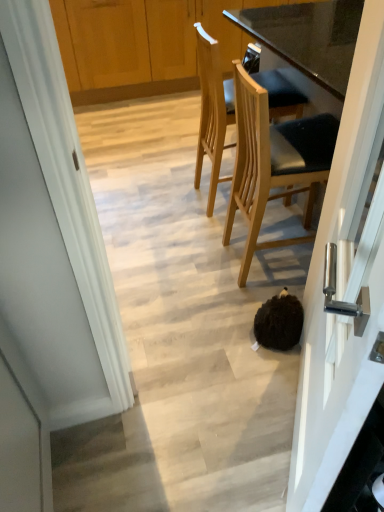
Question: Would you say light wood/texture chair at upper center, which is the 2th chair from front to back, is part of white glossy door handle at center right's contents?

Choices:
 (A) yes
 (B) no

Answer: (B)

Question: Is white glossy door handle at center right bigger than light wood/texture chair at upper center, arranged as the first chair when viewed from the back?

Choices:
 (A) no
 (B) yes

Answer: (A)

Question: From the image's perspective, does white glossy door handle at center right appear lower than light wood/texture chair at upper center, arranged as the first chair when viewed from the back?

Choices:
 (A) yes
 (B) no

Answer: (A)

Question: Can you confirm if white glossy door handle at center right is wider than light wood/texture chair at upper center, arranged as the first chair when viewed from the back?

Choices:
 (A) no
 (B) yes

Answer: (A)

Question: Does white glossy door handle at center right lie in front of light wood/texture chair at upper center, arranged as the first chair when viewed from the back?

Choices:
 (A) no
 (B) yes

Answer: (B)

Question: In terms of height, does light wood/texture chair at upper center, which is the 2th chair from front to back, look taller or shorter compared to white glossy door handle at center right?

Choices:
 (A) tall
 (B) short

Answer: (B)

Question: From a real-world perspective, is light wood/texture chair at upper center, arranged as the first chair when viewed from the back, positioned above or below white glossy door handle at center right?

Choices:
 (A) below
 (B) above

Answer: (A)

Question: Based on their sizes in the image, would you say light wood/texture chair at upper center, arranged as the first chair when viewed from the back, is bigger or smaller than white glossy door handle at center right?

Choices:
 (A) small
 (B) big

Answer: (B)

Question: Considering the relative positions of light wood/texture chair at upper center, which is the 2th chair from front to back, and white glossy door handle at center right in the image provided, is light wood/texture chair at upper center, which is the 2th chair from front to back, to the left or to the right of white glossy door handle at center right?

Choices:
 (A) right
 (B) left

Answer: (B)

Question: From the image's perspective, is light wood/texture chair at upper center, arranged as the first chair when viewed from the back, located above or below light brown wood chair at center, which ranks as the 2th chair in back-to-front order?

Choices:
 (A) above
 (B) below

Answer: (A)

Question: From a real-world perspective, relative to light brown wood chair at center, marked as the first chair in a front-to-back arrangement, is light wood/texture chair at upper center, arranged as the first chair when viewed from the back, vertically above or below?

Choices:
 (A) above
 (B) below

Answer: (B)

Question: Is point (213, 188) positioned closer to the camera than point (253, 205)?

Choices:
 (A) closer
 (B) farther

Answer: (B)

Question: Considering the relative positions of light wood/texture chair at upper center, arranged as the first chair when viewed from the back, and light brown wood chair at center, marked as the first chair in a front-to-back arrangement, in the image provided, is light wood/texture chair at upper center, arranged as the first chair when viewed from the back, to the left or to the right of light brown wood chair at center, marked as the first chair in a front-to-back arrangement,?

Choices:
 (A) right
 (B) left

Answer: (B)

Question: Is light brown wood chair at center, marked as the first chair in a front-to-back arrangement, taller or shorter than white glossy door handle at center right?

Choices:
 (A) tall
 (B) short

Answer: (B)

Question: From the image's perspective, is light brown wood chair at center, which ranks as the 2th chair in back-to-front order, above or below white glossy door handle at center right?

Choices:
 (A) above
 (B) below

Answer: (A)